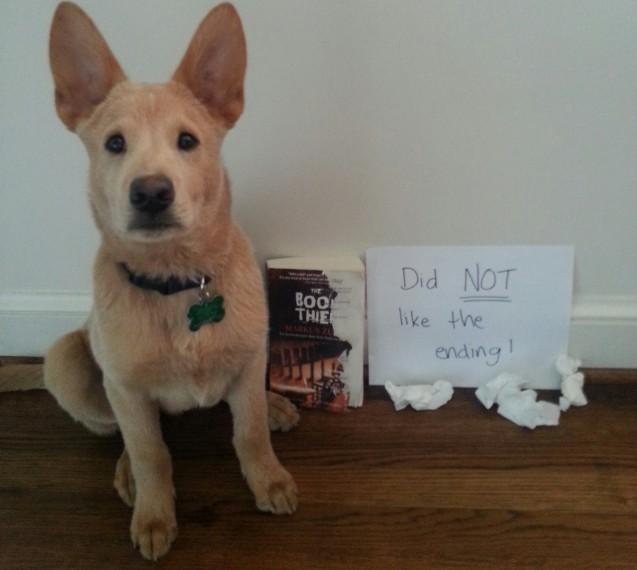
Find the location of `book`. book is located at coordinates (306, 309).